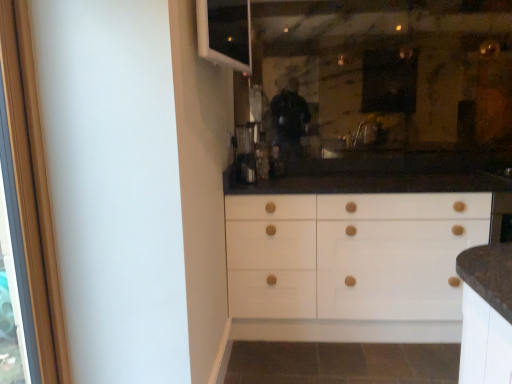
Question: Does white plastic window at upper left have a smaller size compared to metallic silver coffee machine at center?

Choices:
 (A) no
 (B) yes

Answer: (A)

Question: Can you confirm if white plastic window at upper left is shorter than metallic silver coffee machine at center?

Choices:
 (A) yes
 (B) no

Answer: (B)

Question: From the image's perspective, is white plastic window at upper left located above metallic silver coffee machine at center?

Choices:
 (A) yes
 (B) no

Answer: (A)

Question: Does white plastic window at upper left have a lesser width compared to metallic silver coffee machine at center?

Choices:
 (A) no
 (B) yes

Answer: (B)

Question: Considering the relative positions of white plastic window at upper left and metallic silver coffee machine at center in the image provided, is white plastic window at upper left in front of metallic silver coffee machine at center?

Choices:
 (A) yes
 (B) no

Answer: (A)

Question: Is white plastic window at upper left behind metallic silver coffee machine at center?

Choices:
 (A) no
 (B) yes

Answer: (A)

Question: Can you confirm if wooden screen door at left is thinner than white plastic window at upper left?

Choices:
 (A) yes
 (B) no

Answer: (B)

Question: Is wooden screen door at left to the left of white plastic window at upper left from the viewer's perspective?

Choices:
 (A) yes
 (B) no

Answer: (A)

Question: From the image's perspective, would you say wooden screen door at left is shown under white plastic window at upper left?

Choices:
 (A) no
 (B) yes

Answer: (B)

Question: Is white plastic window at upper left surrounded by wooden screen door at left?

Choices:
 (A) yes
 (B) no

Answer: (B)

Question: Is wooden screen door at left shorter than white plastic window at upper left?

Choices:
 (A) yes
 (B) no

Answer: (B)

Question: Would you say wooden screen door at left is outside white plastic window at upper left?

Choices:
 (A) yes
 (B) no

Answer: (A)

Question: Does metallic silver coffee machine at center appear on the left side of white plastic window at upper left?

Choices:
 (A) yes
 (B) no

Answer: (B)